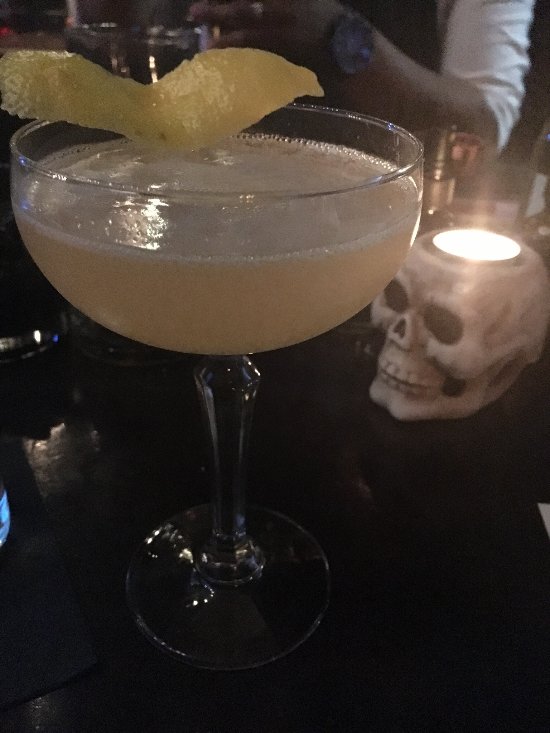
This screenshot has width=550, height=733. Identify the location of skull candle holder. (497, 302).